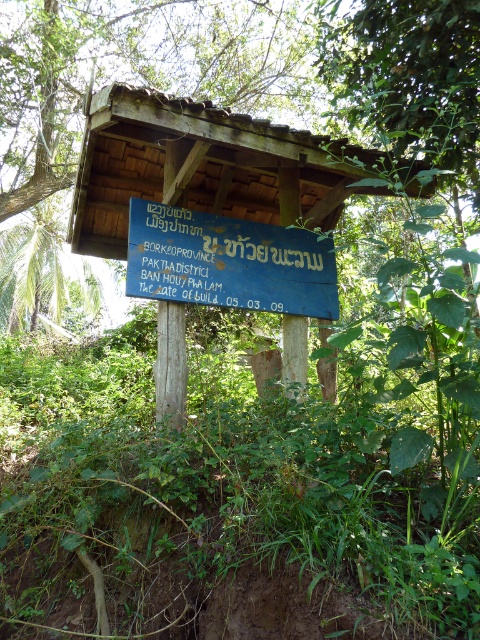
Question: Which point is closer to the camera?

Choices:
 (A) wooden signboard at center
 (B) blue painted wood sign at center

Answer: (A)

Question: Among these points, which one is farthest from the camera?

Choices:
 (A) (222, 291)
 (B) (323, 156)

Answer: (A)

Question: Which point is closer to the camera taking this photo?

Choices:
 (A) coord(176,291)
 (B) coord(333,195)

Answer: (A)

Question: Does wooden signboard at center have a larger size compared to blue painted wood sign at center?

Choices:
 (A) yes
 (B) no

Answer: (A)

Question: Can you confirm if wooden signboard at center is positioned below blue painted wood sign at center?

Choices:
 (A) yes
 (B) no

Answer: (B)

Question: Is wooden signboard at center to the right of blue painted wood sign at center from the viewer's perspective?

Choices:
 (A) no
 (B) yes

Answer: (A)